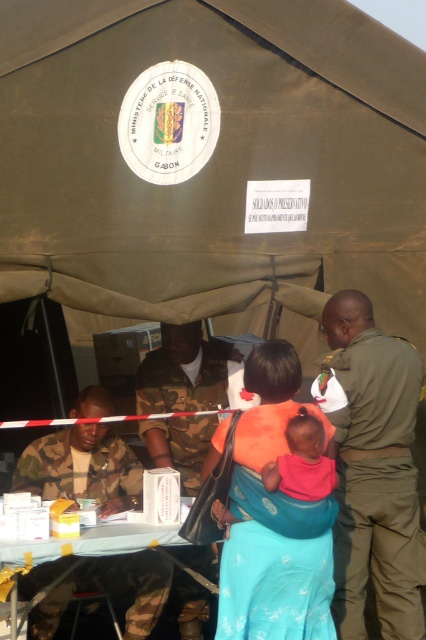
You are a nurse in the military tent and you need to place the orange fabric baby carrier at center and the pink fabric baby at center on the table. Which object should you place first to ensure there is enough space for both?

You should place the orange fabric baby carrier at center first because it is much taller than the pink fabric baby at center, so it requires more space.

You are a healthcare worker organizing supplies in the military tent. You need to place both the camo uniform at center and the pink fabric baby at center on a shelf. The shelf can only hold items that are smaller than a certain size. Which item should you place first to ensure both fit?

The pink fabric baby at center is smaller than the camo uniform at center, so you should place the pink fabric baby at center first to ensure both fit on the shelf.

You are a soldier needing to choose between the green uniform at right and the camo uniform at center for a mission requiring flexibility. Which uniform is more suitable based on their thickness?

The green uniform at right is thinner than the camo uniform at center, so it is more suitable for a mission requiring flexibility as it offers less bulk.